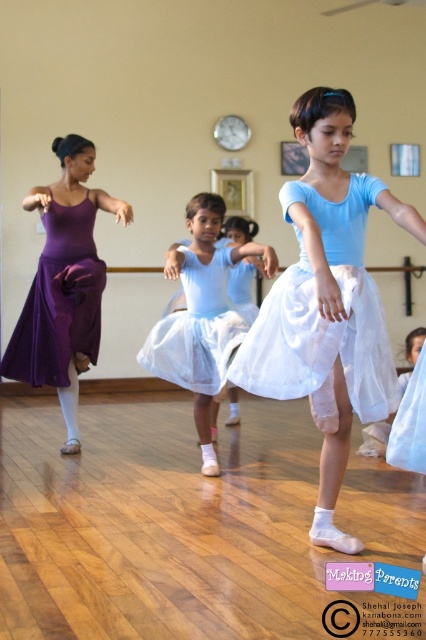
Question: Can you confirm if light blue satin tutu at center is positioned below purple satin skirt at left?

Choices:
 (A) no
 (B) yes

Answer: (B)

Question: Estimate the real-world distances between objects in this image. Which object is closer to the purple satin skirt at left?

Choices:
 (A) white satin skirt at center
 (B) light blue satin ballet skirt at center

Answer: (A)

Question: In this image, where is light blue satin ballet skirt at center located relative to light blue satin tutu at center?

Choices:
 (A) below
 (B) above

Answer: (B)

Question: Is purple satin skirt at left further to camera compared to white satin skirt at center?

Choices:
 (A) no
 (B) yes

Answer: (B)

Question: Which object is closer to the camera taking this photo?

Choices:
 (A) light blue satin tutu at center
 (B) white satin skirt at center

Answer: (A)

Question: Which point is closer to the camera?

Choices:
 (A) white satin ballet skirt at center
 (B) light blue satin ballet skirt at center
 (C) purple satin skirt at left

Answer: (B)